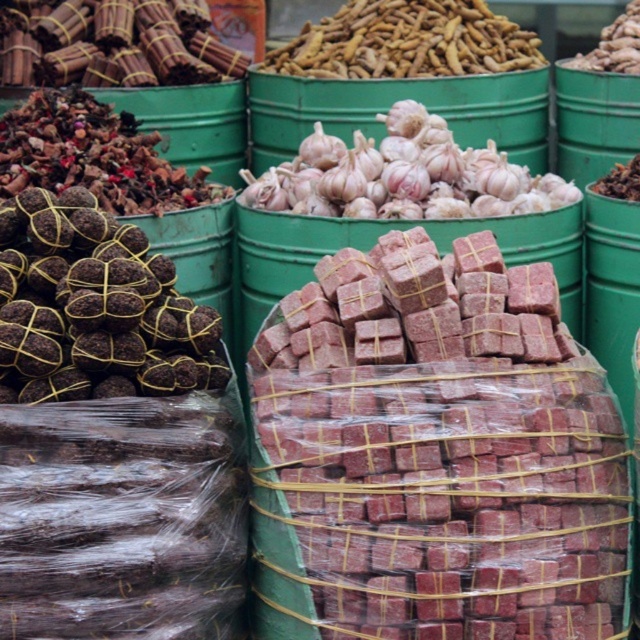
You are a customer at the market looking for the white matte garlic at center and the brown woven roots at left. Which item is located to the right of the other?

The white matte garlic at center is positioned on the right side of brown woven roots at left.

You are a vendor at the market and want to display two items side by side on a shelf. You have the brown woven balls at left and the smooth brown nuts at upper center. Which item will take up more space horizontally on the shelf?

The brown woven balls at left will take up more space horizontally on the shelf because their width is larger than the smooth brown nuts at upper center.